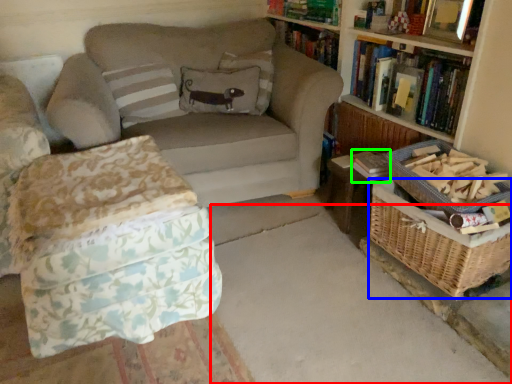
Question: Which object is positioned farthest from concrete (highlighted by a red box)? Select from basket (highlighted by a blue box) and paperback book (highlighted by a green box).

Choices:
 (A) basket
 (B) paperback book

Answer: (B)